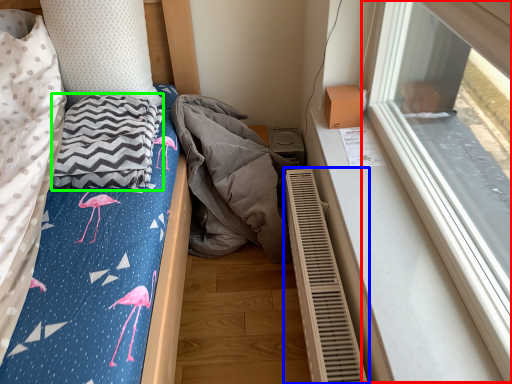
Question: Considering the real-world distances, which object is closest to window (highlighted by a red box)? radiator (highlighted by a blue box) or blanket (highlighted by a green box).

Choices:
 (A) radiator
 (B) blanket

Answer: (A)